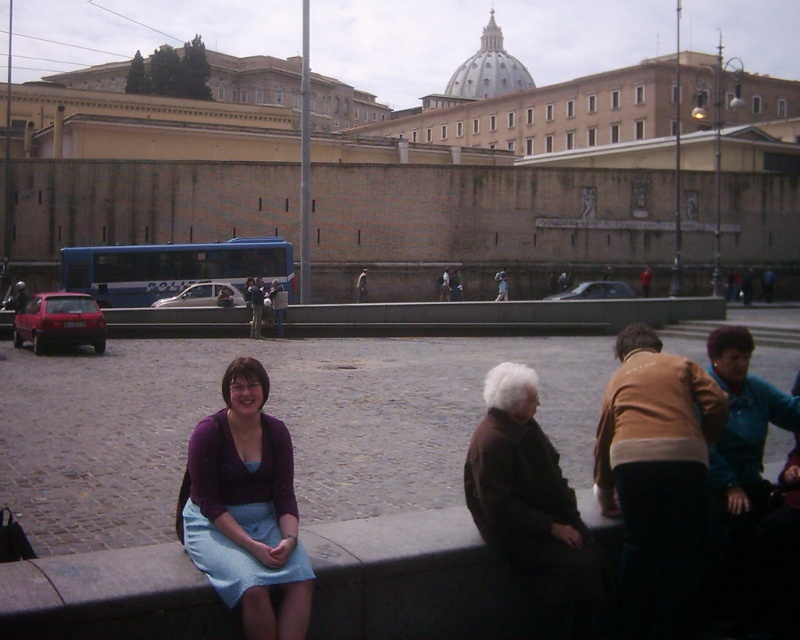
Between purple fabric skirt at lower left and brown woolen sweater at lower right, which one appears on the right side from the viewer's perspective?

Positioned to the right is brown woolen sweater at lower right.

From the picture: Is the position of purple fabric skirt at lower left more distant than that of brown woolen sweater at lower right?

That is False.

At what (x,y) coordinates should I click in order to perform the action: click on purple fabric skirt at lower left. Please return your answer as a coordinate pair (x, y). Looking at the image, I should click on (246, 508).